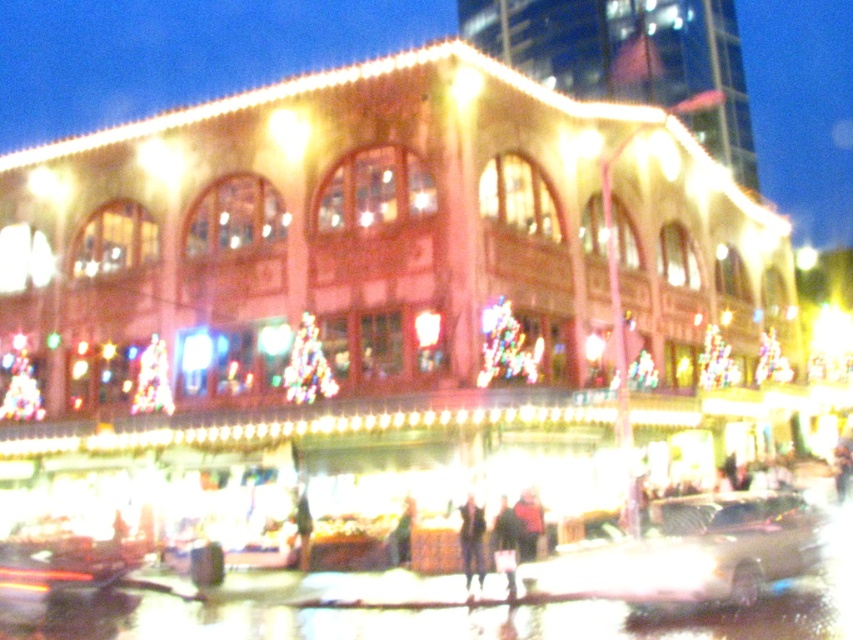
Can you confirm if metallic silver car at lower left is wider than dark blue jacket at center?

Yes.

Which is above, metallic silver car at lower left or dark blue jacket at center?

dark blue jacket at center

Where is `metallic silver car at lower left`? metallic silver car at lower left is located at coordinates (56, 570).

Does clear glass water at lower center have a lesser width compared to metallic gold car at lower center?

No, clear glass water at lower center is not thinner than metallic gold car at lower center.

Which is in front, point (42, 625) or point (705, 544)?

Point (705, 544)

Is point (566, 637) positioned after point (718, 504)?

No, (566, 637) is in front of (718, 504).

The width and height of the screenshot is (853, 640). In order to click on clear glass water at lower center in this screenshot , I will do [450, 618].

Between metallic silver car at lower left and dark brown leather jacket at center, which one is positioned lower?

metallic silver car at lower left is lower down.

Which is more to the right, metallic silver car at lower left or dark brown leather jacket at center?

From the viewer's perspective, dark brown leather jacket at center appears more on the right side.

At what (x,y) coordinates should I click in order to perform the action: click on metallic silver car at lower left. Please return your answer as a coordinate pair (x, y). Looking at the image, I should click on (56, 570).

You are a GUI agent. You are given a task and a screenshot of the screen. Output one action in this format:
    pyautogui.click(x=<x>, y=<y>)
    Task: Click on the metallic silver car at lower left
    
    Given the screenshot: What is the action you would take?
    pyautogui.click(x=56, y=570)